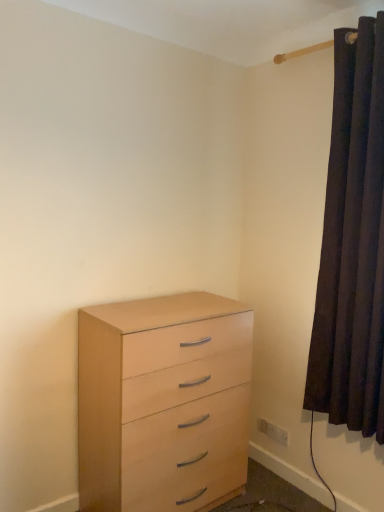
Identify the location of vacant region above light wood chest of drawers at lower left (from a real-world perspective). This screenshot has width=384, height=512. (160, 308).